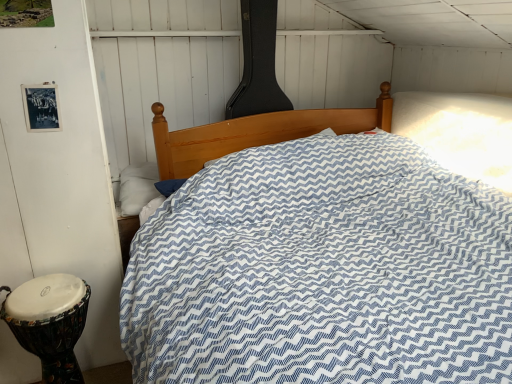
Question: Is white leather drum at lower left located within white soft pillow at left?

Choices:
 (A) no
 (B) yes

Answer: (A)

Question: Considering the relative sizes of white soft pillow at left and white leather drum at lower left in the image provided, is white soft pillow at left smaller than white leather drum at lower left?

Choices:
 (A) no
 (B) yes

Answer: (B)

Question: Is white soft pillow at left closer to the viewer compared to white leather drum at lower left?

Choices:
 (A) yes
 (B) no

Answer: (B)

Question: Is white soft pillow at left to the right of white leather drum at lower left from the viewer's perspective?

Choices:
 (A) yes
 (B) no

Answer: (A)

Question: Is the position of white soft pillow at left more distant than that of white leather drum at lower left?

Choices:
 (A) no
 (B) yes

Answer: (B)

Question: Is the surface of white soft pillow at left in direct contact with white leather drum at lower left?

Choices:
 (A) no
 (B) yes

Answer: (A)

Question: Is white leather drum at lower left not inside white soft pillow at left?

Choices:
 (A) yes
 (B) no

Answer: (A)

Question: Does white leather drum at lower left come behind white soft pillow at left?

Choices:
 (A) yes
 (B) no

Answer: (B)

Question: From a real-world perspective, is white leather drum at lower left located higher than white soft pillow at left?

Choices:
 (A) no
 (B) yes

Answer: (A)

Question: From the image's perspective, is white leather drum at lower left on top of white soft pillow at left?

Choices:
 (A) yes
 (B) no

Answer: (B)

Question: Considering the relative positions of white leather drum at lower left and white soft pillow at left in the image provided, is white leather drum at lower left in front of white soft pillow at left?

Choices:
 (A) no
 (B) yes

Answer: (B)

Question: From the image's perspective, is white leather drum at lower left beneath white soft pillow at left?

Choices:
 (A) no
 (B) yes

Answer: (B)

Question: Considering the positions of point (69, 374) and point (121, 175), is point (69, 374) closer or farther from the camera than point (121, 175)?

Choices:
 (A) closer
 (B) farther

Answer: (A)